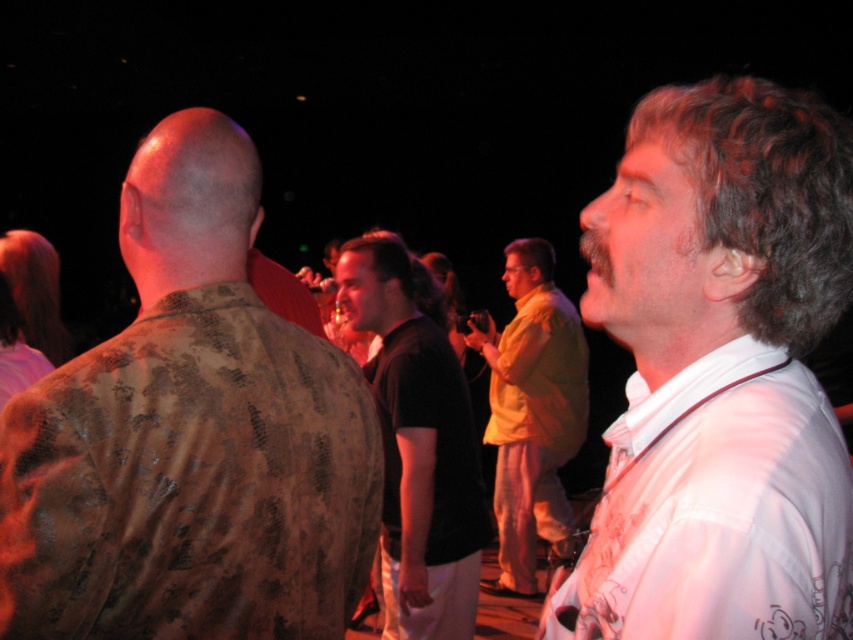
Question: In this image, where is camouflage shirt at left located relative to white satin shirt at right?

Choices:
 (A) above
 (B) below

Answer: (B)

Question: Which of the following is the farthest from the observer?

Choices:
 (A) white satin shirt at right
 (B) camouflage shirt at left

Answer: (B)

Question: Can you confirm if white satin shirt at right is wider than yellow fabric shirt at center?

Choices:
 (A) yes
 (B) no

Answer: (B)

Question: Which object is the farthest from the yellow fabric shirt at center?

Choices:
 (A) camouflage shirt at left
 (B) black cotton shirt at center

Answer: (A)

Question: Which object appears farthest from the camera in this image?

Choices:
 (A) camouflage shirt at left
 (B) white satin shirt at right

Answer: (A)

Question: Does camouflage shirt at left have a larger size compared to yellow fabric shirt at center?

Choices:
 (A) no
 (B) yes

Answer: (A)